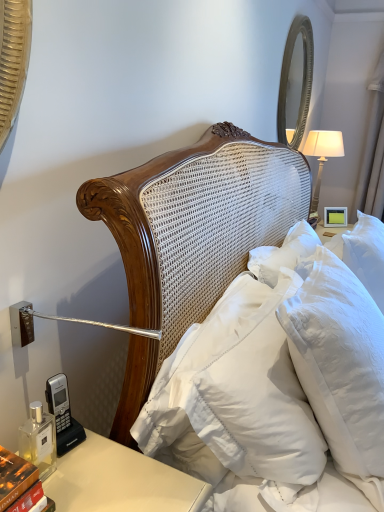
Question: Which is correct: white soft pillow at upper right, the second pillow from the left, is inside silver textured mirror at upper right, or outside of it?

Choices:
 (A) outside
 (B) inside

Answer: (A)

Question: From a real-world perspective, is white soft pillow at upper right, the 1th pillow from the right, above or below silver textured mirror at upper right?

Choices:
 (A) below
 (B) above

Answer: (A)

Question: Considering the real-world distances, which object is closest to the silver textured mirror at upper right?

Choices:
 (A) hardcover book at lower left
 (B) white soft pillow at center, the 2th pillow positioned from the right
 (C) white fabric lampshade at upper right
 (D) white soft pillow at upper right, the second pillow from the left
 (E) matte yellow picture frame at upper right

Answer: (C)

Question: Which object is the closest to the white fabric lampshade at upper right?

Choices:
 (A) matte yellow picture frame at upper right
 (B) white soft pillow at upper right, the 1th pillow from the right
 (C) silver textured mirror at upper right
 (D) hardcover book at lower left
 (E) white soft pillow at center, the 2th pillow positioned from the right

Answer: (A)